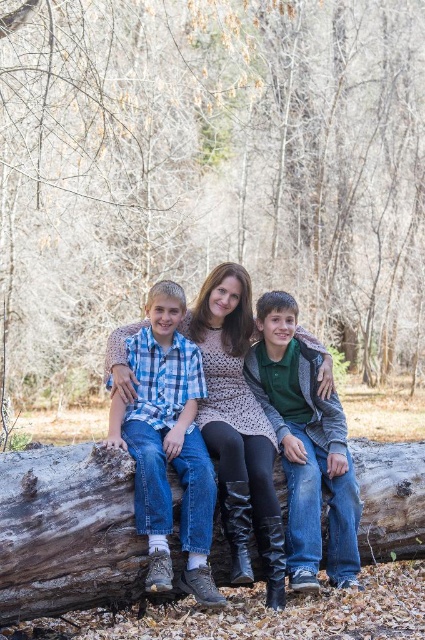
Can you confirm if brown wood log at lower center is thinner than plaid cotton shirt at left?

No.

Is point (249, 212) closer to camera compared to point (144, 355)?

No, (249, 212) is behind (144, 355).

Where is `brown wood log at lower center`? brown wood log at lower center is located at coordinates (209, 172).

Based on the photo, is brown wood log at lower center to the right of green cotton shirt at center from the viewer's perspective?

Correct, you'll find brown wood log at lower center to the right of green cotton shirt at center.

Between brown wood log at lower center and green cotton shirt at center, which one is positioned lower?

Positioned lower is green cotton shirt at center.

Measure the distance between brown wood log at lower center and camera.

They are 7.20 meters apart.

Where is `brown wood log at lower center`? The width and height of the screenshot is (425, 640). brown wood log at lower center is located at coordinates (209, 172).

Does knit sweater at center lie behind plaid cotton shirt at left?

Yes, knit sweater at center is further from the viewer.

I want to click on knit sweater at center, so click(274, 436).

Find the location of a particular element. The height and width of the screenshot is (640, 425). knit sweater at center is located at coordinates (274, 436).